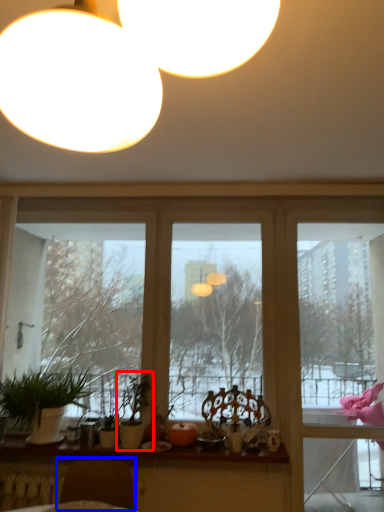
Question: Among these objects, which one is farthest to the camera, houseplant (highlighted by a red box) or swivel chair (highlighted by a blue box)?

Choices:
 (A) houseplant
 (B) swivel chair

Answer: (A)